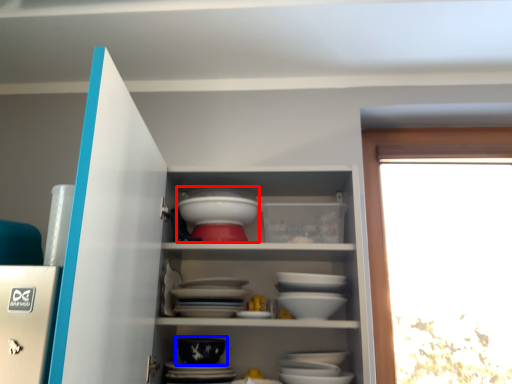
Question: Which of the following is the farthest to the observer, tableware (highlighted by a red box) or bowl (highlighted by a blue box)?

Choices:
 (A) tableware
 (B) bowl

Answer: (A)